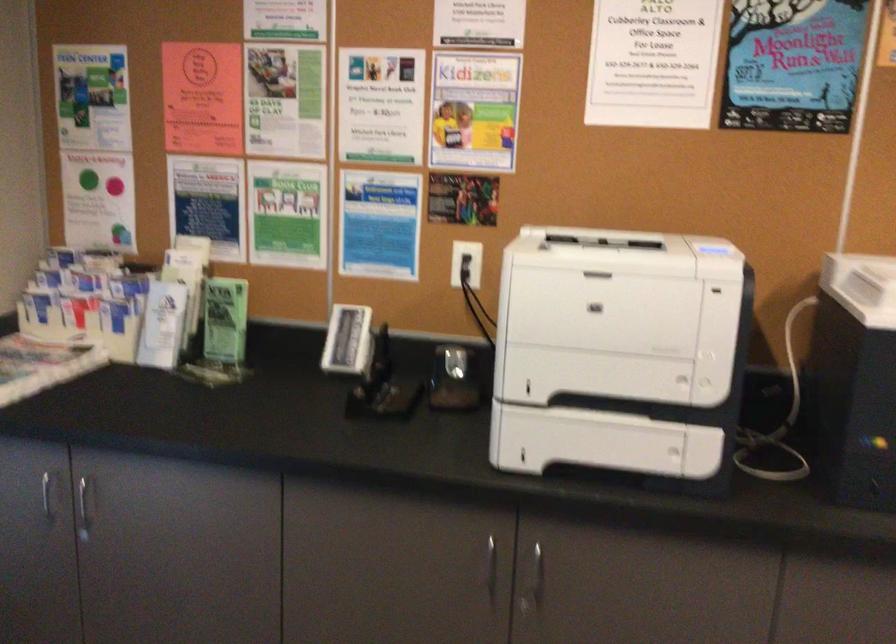
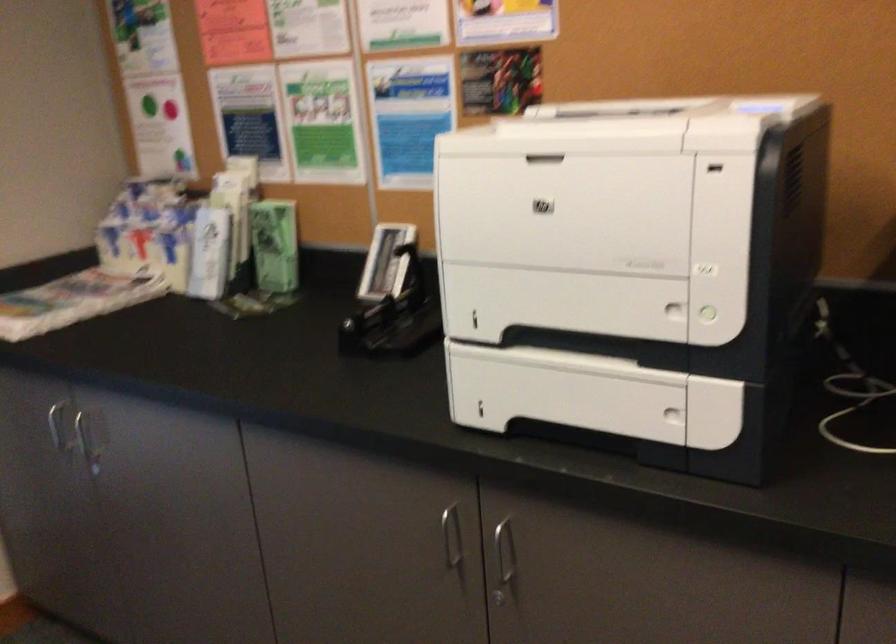
The point at (530, 569) is marked in the first image. Where is the corresponding point in the second image?

(504, 559)